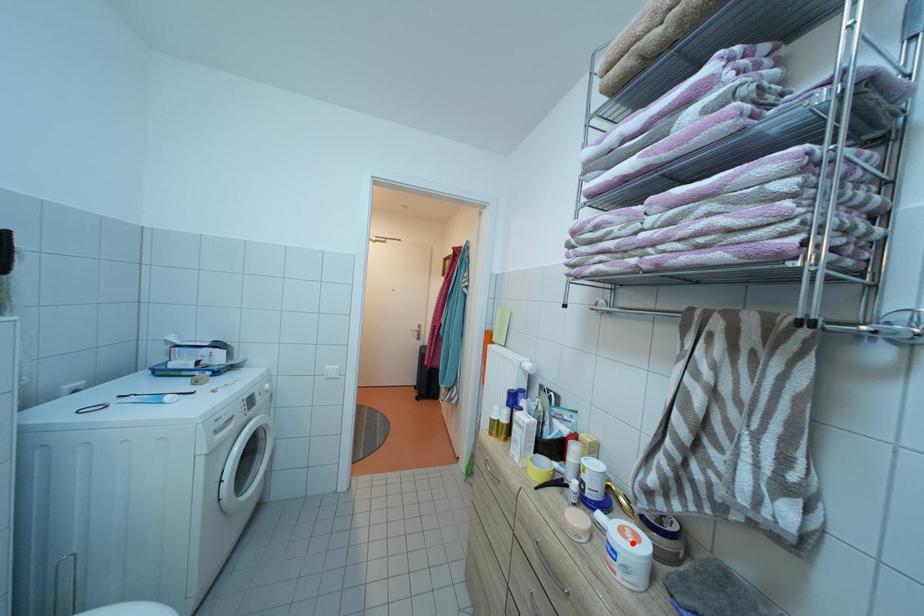
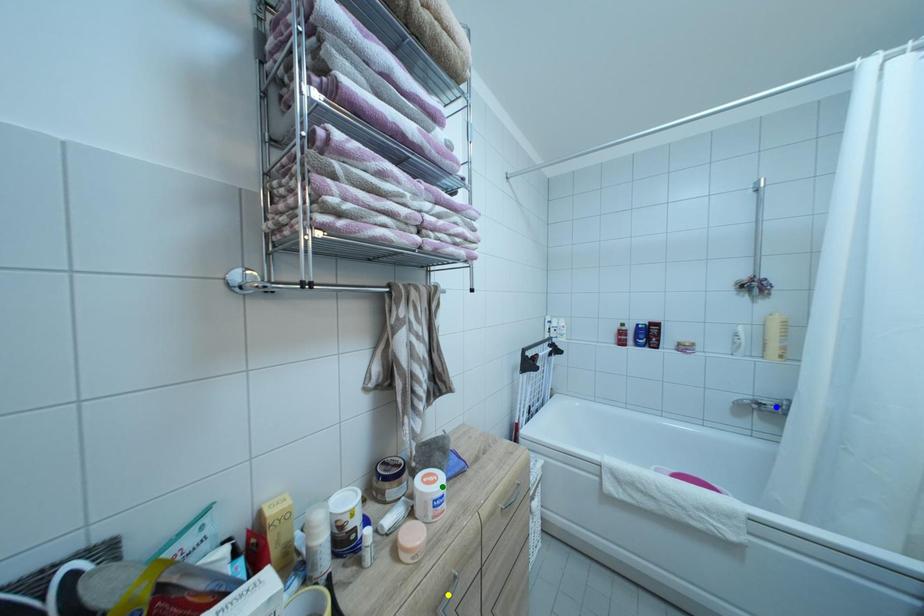
Question: I am providing you with two images of the same scene from different viewpoints. A red point is marked on the first image. You are given multiple points on the second image. Which spot in image 2 lines up with the point in image 1?

Choices:
 (A) blue point
 (B) green point
 (C) yellow point

Answer: (B)